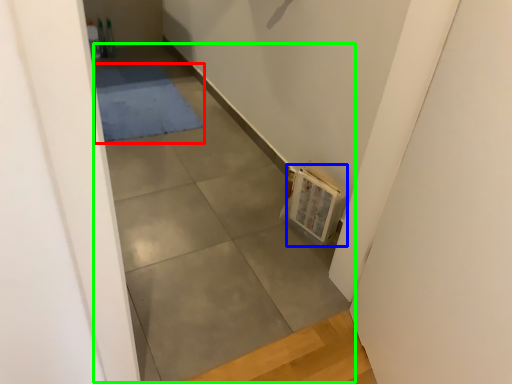
Question: Estimate the real-world distances between objects in this image. Which object is closer to mat (highlighted by a red box), book (highlighted by a blue box) or concrete (highlighted by a green box)?

Choices:
 (A) book
 (B) concrete

Answer: (B)